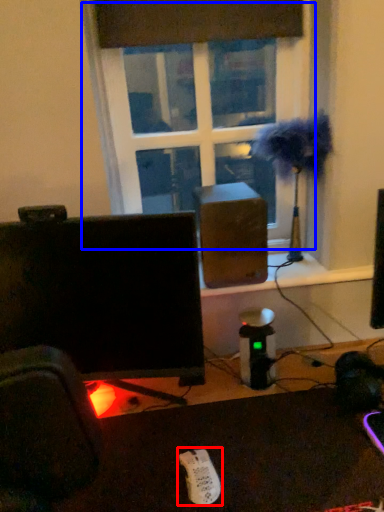
Question: Which object is closer to the camera taking this photo, Wii controller (highlighted by a red box) or window (highlighted by a blue box)?

Choices:
 (A) Wii controller
 (B) window

Answer: (A)